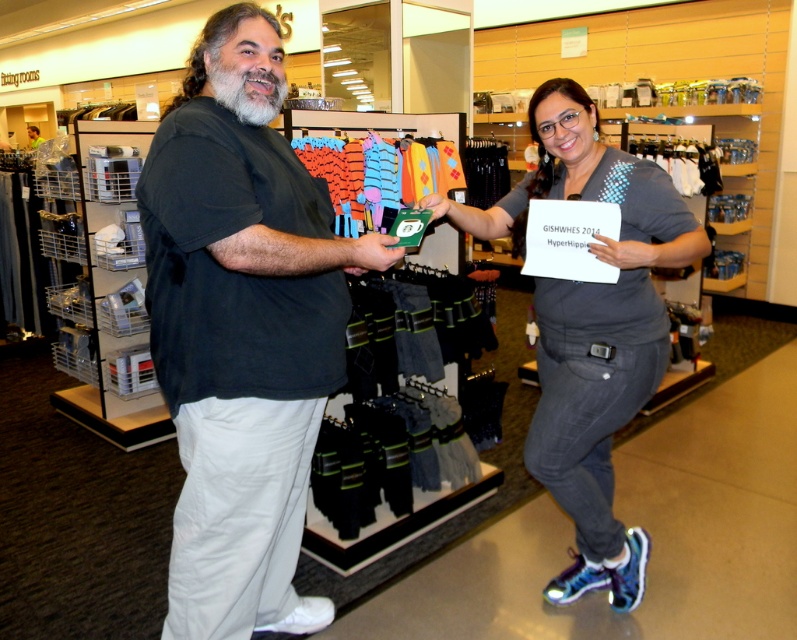
Can you confirm if black matte t-shirt at center is positioned to the left of gray denim jeans at center?

Correct, you'll find black matte t-shirt at center to the left of gray denim jeans at center.

Does black matte t-shirt at center have a greater height compared to gray denim jeans at center?

Yes, black matte t-shirt at center is taller than gray denim jeans at center.

Does point (238, 179) lie in front of point (532, 120)?

Yes, it is in front of point (532, 120).

Identify the location of black matte t-shirt at center. (241, 330).